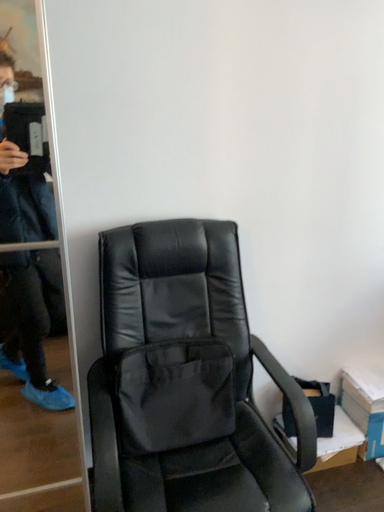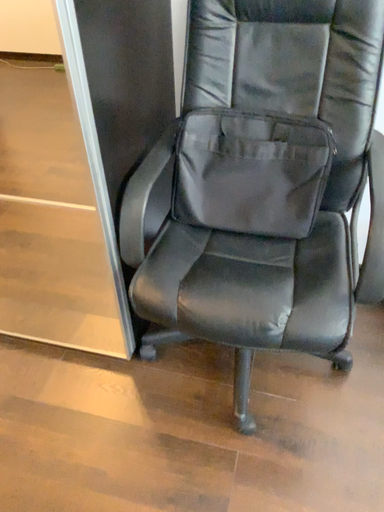
Question: How did the camera likely rotate when shooting the video?

Choices:
 (A) rotated right
 (B) rotated left

Answer: (B)